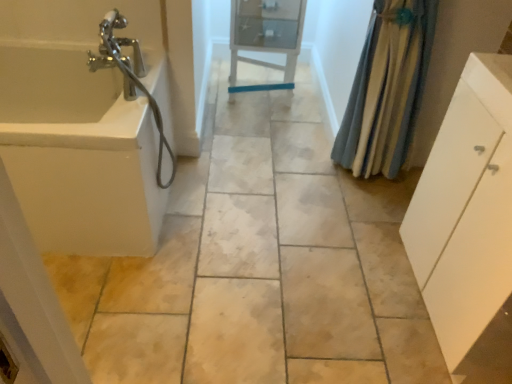
Question: Is white glossy cabinet at center beside blue textured fabric shower curtain at right?

Choices:
 (A) yes
 (B) no

Answer: (B)

Question: Is white glossy cabinet at center looking in the opposite direction of blue textured fabric shower curtain at right?

Choices:
 (A) no
 (B) yes

Answer: (A)

Question: Is white glossy cabinet at center taller than blue textured fabric shower curtain at right?

Choices:
 (A) yes
 (B) no

Answer: (B)

Question: Is white glossy cabinet at center at the right side of blue textured fabric shower curtain at right?

Choices:
 (A) no
 (B) yes

Answer: (A)

Question: Does white glossy cabinet at center have a smaller size compared to blue textured fabric shower curtain at right?

Choices:
 (A) yes
 (B) no

Answer: (B)

Question: Considering the positions of point (385, 160) and point (452, 129), is point (385, 160) closer or farther from the camera than point (452, 129)?

Choices:
 (A) farther
 (B) closer

Answer: (A)

Question: From a real-world perspective, relative to white matte cabinet at right, is blue textured fabric shower curtain at right vertically above or below?

Choices:
 (A) above
 (B) below

Answer: (A)

Question: In terms of height, does blue textured fabric shower curtain at right look taller or shorter compared to white matte cabinet at right?

Choices:
 (A) tall
 (B) short

Answer: (A)

Question: Is blue textured fabric shower curtain at right situated inside white matte cabinet at right or outside?

Choices:
 (A) outside
 (B) inside

Answer: (A)

Question: Is blue textured fabric shower curtain at right inside or outside of white glossy cabinet at center?

Choices:
 (A) inside
 (B) outside

Answer: (B)

Question: From the image's perspective, is blue textured fabric shower curtain at right above or below white glossy cabinet at center?

Choices:
 (A) above
 (B) below

Answer: (B)

Question: Considering the relative positions of blue textured fabric shower curtain at right and white glossy cabinet at center in the image provided, is blue textured fabric shower curtain at right to the left or to the right of white glossy cabinet at center?

Choices:
 (A) right
 (B) left

Answer: (A)

Question: Considering the positions of point (373, 112) and point (230, 77), is point (373, 112) closer or farther from the camera than point (230, 77)?

Choices:
 (A) farther
 (B) closer

Answer: (B)

Question: Considering the positions of white glossy bathtub at left and white glossy cabinet at center in the image, is white glossy bathtub at left taller or shorter than white glossy cabinet at center?

Choices:
 (A) tall
 (B) short

Answer: (B)

Question: From a real-world perspective, is white glossy bathtub at left physically located above or below white glossy cabinet at center?

Choices:
 (A) below
 (B) above

Answer: (A)